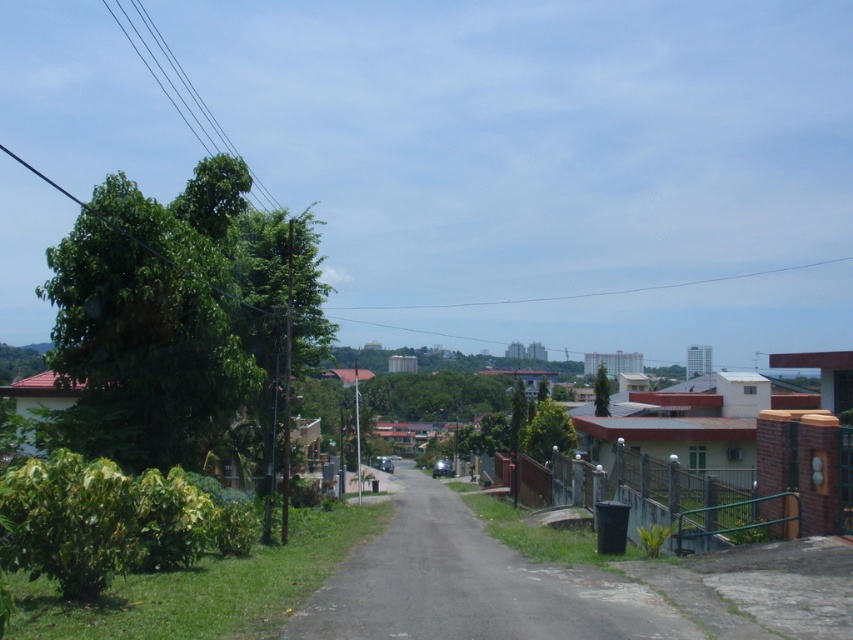
Question: Can you confirm if gray asphalt road at center is wider than green matte tree at center?

Choices:
 (A) no
 (B) yes

Answer: (A)

Question: Among these points, which one is farthest from the camera?

Choices:
 (A) (51, 301)
 (B) (595, 388)
 (C) (585, 596)

Answer: (B)

Question: Which point appears farthest from the camera in this image?

Choices:
 (A) (155, 422)
 (B) (585, 596)
 (C) (602, 410)

Answer: (C)

Question: Is green leafy tree at left thinner than green matte tree at center?

Choices:
 (A) no
 (B) yes

Answer: (B)

Question: Estimate the real-world distances between objects in this image. Which object is farther from the green matte tree at center?

Choices:
 (A) gray asphalt road at center
 (B) green leafy tree at left

Answer: (B)

Question: Is gray asphalt road at center in front of green matte tree at center?

Choices:
 (A) no
 (B) yes

Answer: (B)